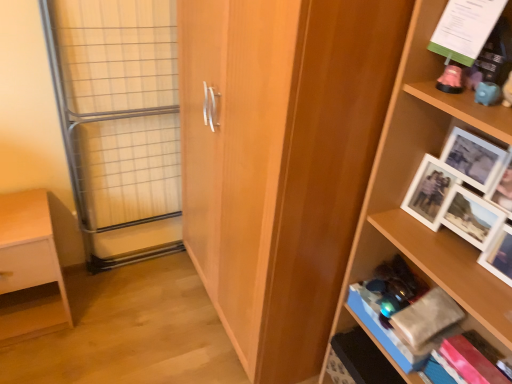
This screenshot has height=384, width=512. I want to click on free location in front of clear glass door at left, so click(129, 302).